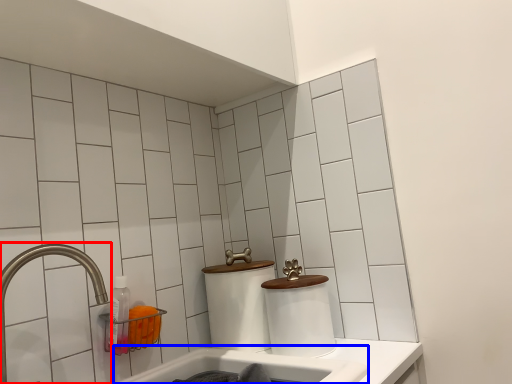
Question: Which object appears farthest to the camera in this image, tap (highlighted by a red box) or bath (highlighted by a blue box)?

Choices:
 (A) tap
 (B) bath

Answer: (B)